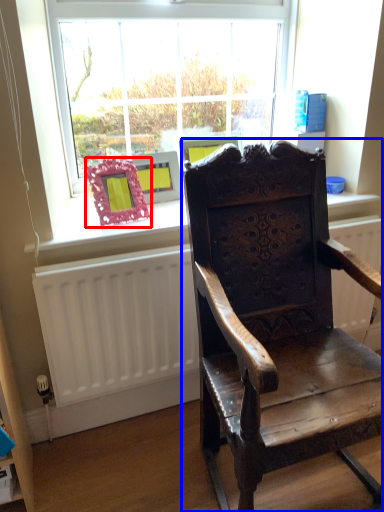
Question: Which object is further to the camera taking this photo, picture frame (highlighted by a red box) or chair (highlighted by a blue box)?

Choices:
 (A) picture frame
 (B) chair

Answer: (A)